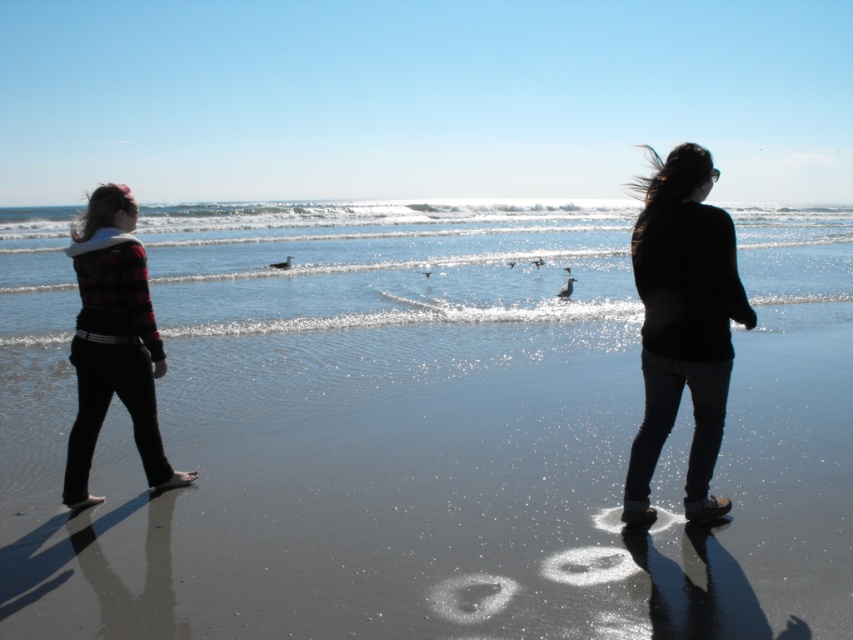
Question: Can you confirm if smooth sand at center is smaller than clear water at center?

Choices:
 (A) yes
 (B) no

Answer: (A)

Question: Which point is closer to the camera?

Choices:
 (A) (6, 602)
 (B) (648, 422)
 (C) (90, 371)
 (D) (593, 268)

Answer: (A)

Question: Is smooth sand at center positioned before black matte sweater at center?

Choices:
 (A) no
 (B) yes

Answer: (B)

Question: Estimate the real-world distances between objects in this image. Which object is farther from the clear water at center?

Choices:
 (A) plaid fabric jacket at left
 (B) smooth sand at center
 (C) black matte sweater at center

Answer: (B)

Question: Which of the following is the farthest from the observer?

Choices:
 (A) plaid fabric jacket at left
 (B) clear water at center
 (C) black matte sweater at center
 (D) smooth sand at center

Answer: (B)

Question: Does smooth sand at center have a greater width compared to plaid fabric jacket at left?

Choices:
 (A) no
 (B) yes

Answer: (B)